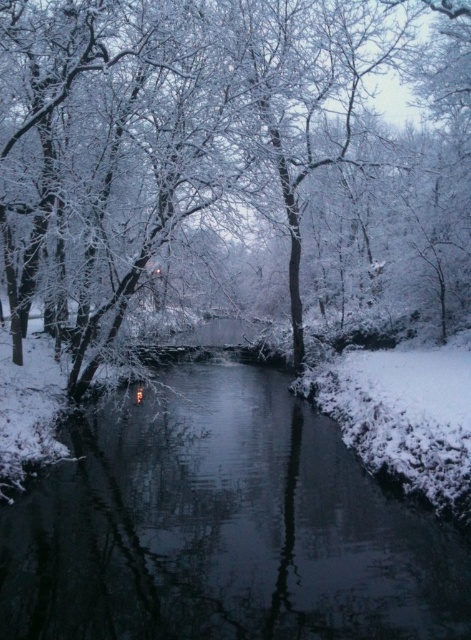
Does white frosty tree at center have a larger size compared to glossy dark water at center?

Indeed, white frosty tree at center has a larger size compared to glossy dark water at center.

Between white frosty tree at center and glossy dark water at center, which one has more height?

white frosty tree at center is taller.

The width and height of the screenshot is (471, 640). What do you see at coordinates (227, 161) in the screenshot? I see `white frosty tree at center` at bounding box center [227, 161].

The image size is (471, 640). Identify the location of white frosty tree at center. (227, 161).